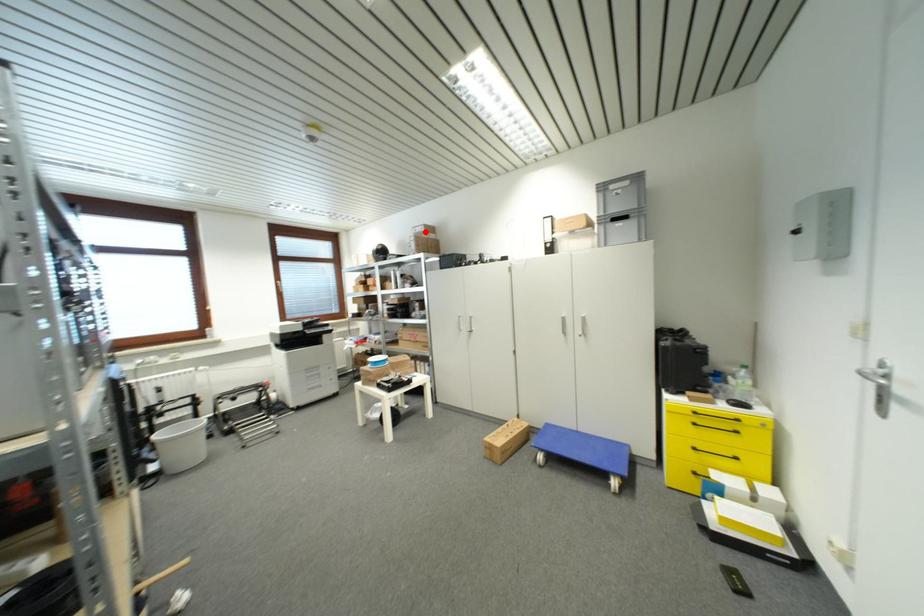
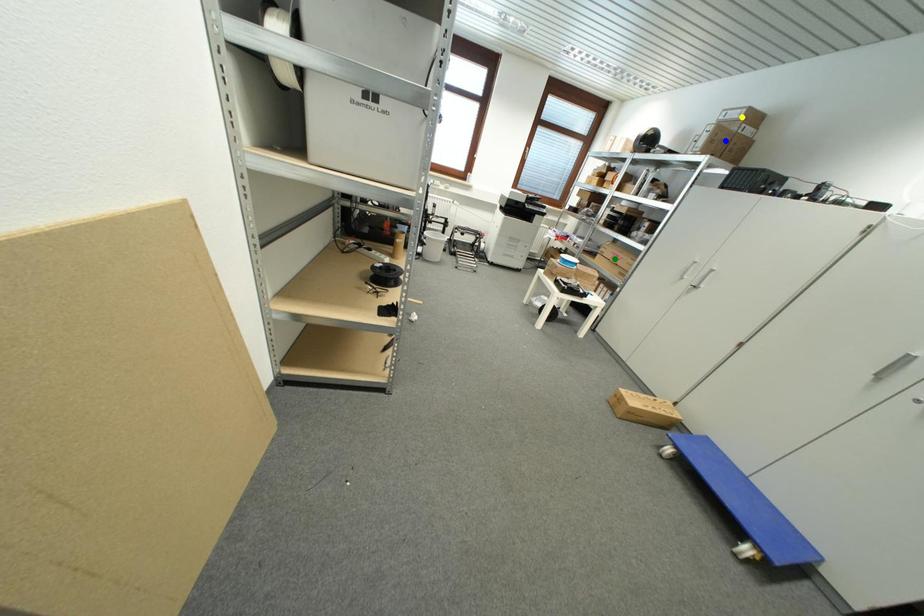
Question: I am providing you with two images of the same scene from different viewpoints. A red point is marked on the first image. You are given multiple points on the second image. Which point in image 2 represents the same 3d spot as the red point in image 1?

Choices:
 (A) green point
 (B) blue point
 (C) yellow point

Answer: (C)